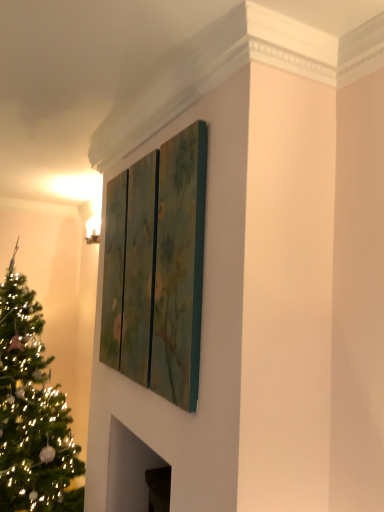
Question: Is textured green triptych at upper center far away from shiny green christmas tree at left?

Choices:
 (A) no
 (B) yes

Answer: (B)

Question: Is shiny green christmas tree at left completely or partially inside textured green triptych at upper center?

Choices:
 (A) yes
 (B) no

Answer: (B)

Question: Is textured green triptych at upper center completely or partially outside of shiny green christmas tree at left?

Choices:
 (A) no
 (B) yes

Answer: (B)

Question: Is textured green triptych at upper center next to shiny green christmas tree at left and touching it?

Choices:
 (A) no
 (B) yes

Answer: (A)

Question: From the image's perspective, is textured green triptych at upper center on shiny green christmas tree at left?

Choices:
 (A) yes
 (B) no

Answer: (A)

Question: From a real-world perspective, is textured green triptych at upper center under shiny green christmas tree at left?

Choices:
 (A) yes
 (B) no

Answer: (B)

Question: Considering the relative sizes of shiny green christmas tree at left and textured green triptych at upper center in the image provided, is shiny green christmas tree at left smaller than textured green triptych at upper center?

Choices:
 (A) yes
 (B) no

Answer: (B)

Question: From the image's perspective, is shiny green christmas tree at left under textured green triptych at upper center?

Choices:
 (A) no
 (B) yes

Answer: (B)

Question: From a real-world perspective, is shiny green christmas tree at left on textured green triptych at upper center?

Choices:
 (A) no
 (B) yes

Answer: (A)

Question: Is shiny green christmas tree at left taller than textured green triptych at upper center?

Choices:
 (A) yes
 (B) no

Answer: (A)

Question: Does shiny green christmas tree at left turn towards textured green triptych at upper center?

Choices:
 (A) no
 (B) yes

Answer: (A)

Question: Is shiny green christmas tree at left to the left of textured green triptych at upper center from the viewer's perspective?

Choices:
 (A) no
 (B) yes

Answer: (B)

Question: Based on their sizes in the image, would you say shiny green christmas tree at left is bigger or smaller than textured green triptych at upper center?

Choices:
 (A) small
 (B) big

Answer: (B)